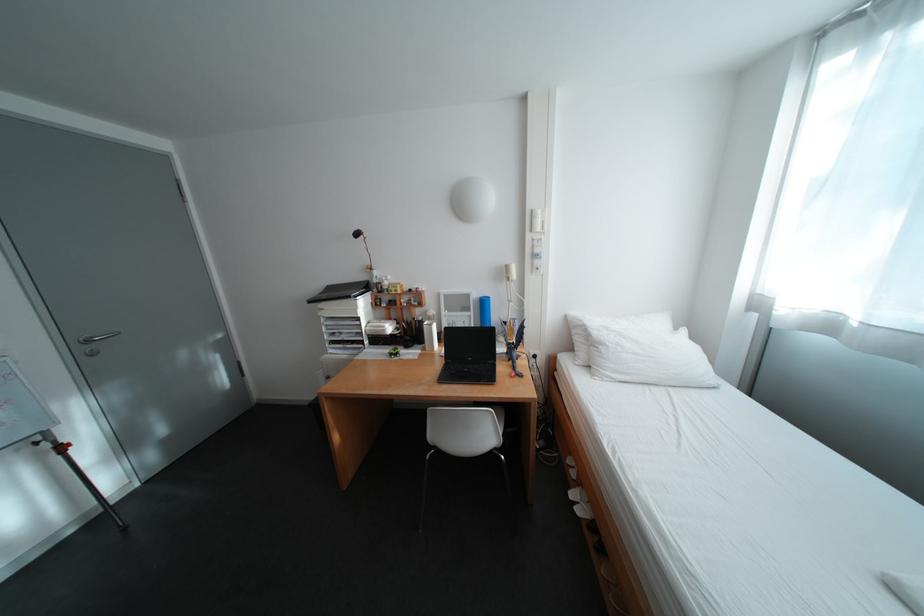
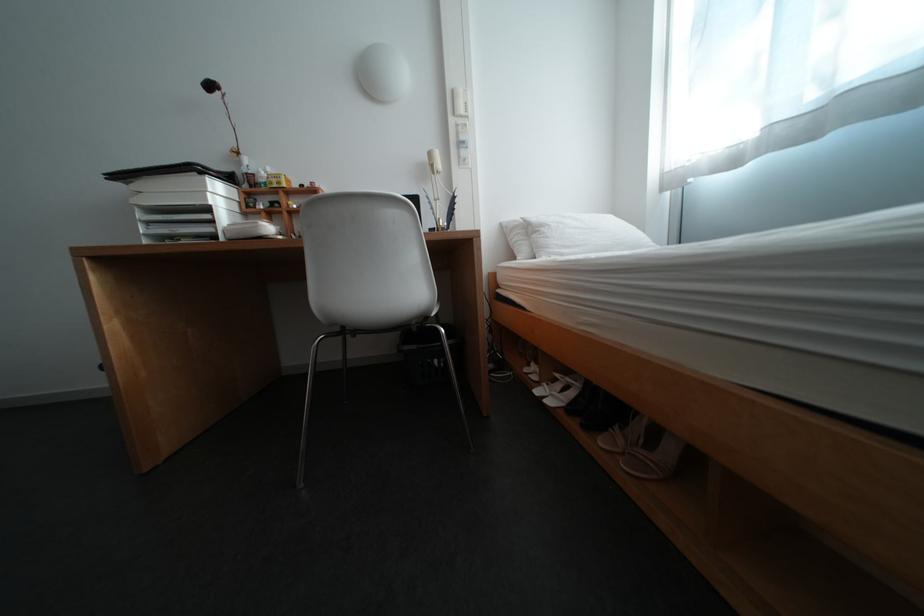
Question: The first image is from the beginning of the video and the second image is from the end. How did the camera likely rotate when shooting the video?

Choices:
 (A) Left
 (B) Right
 (C) Up
 (D) Down

Answer: (B)